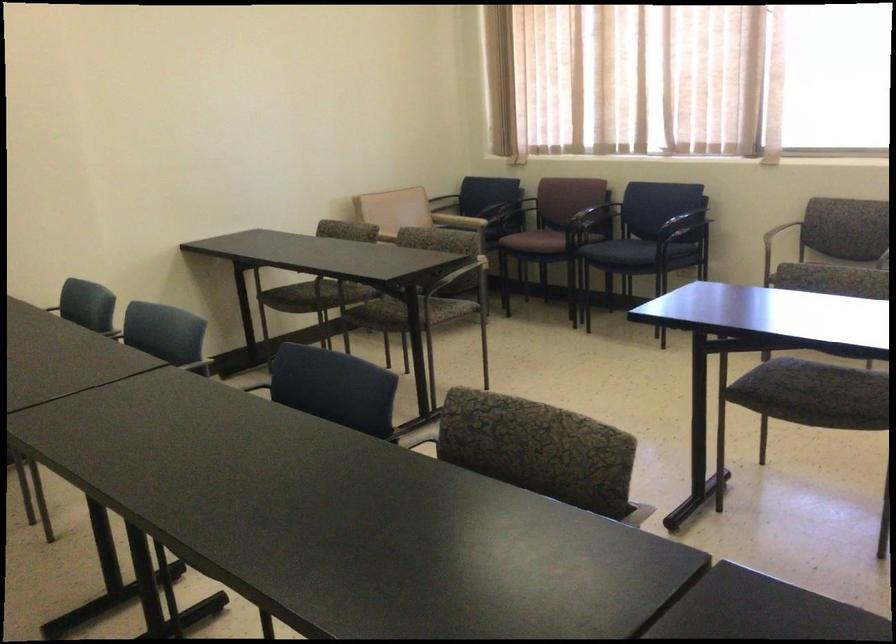
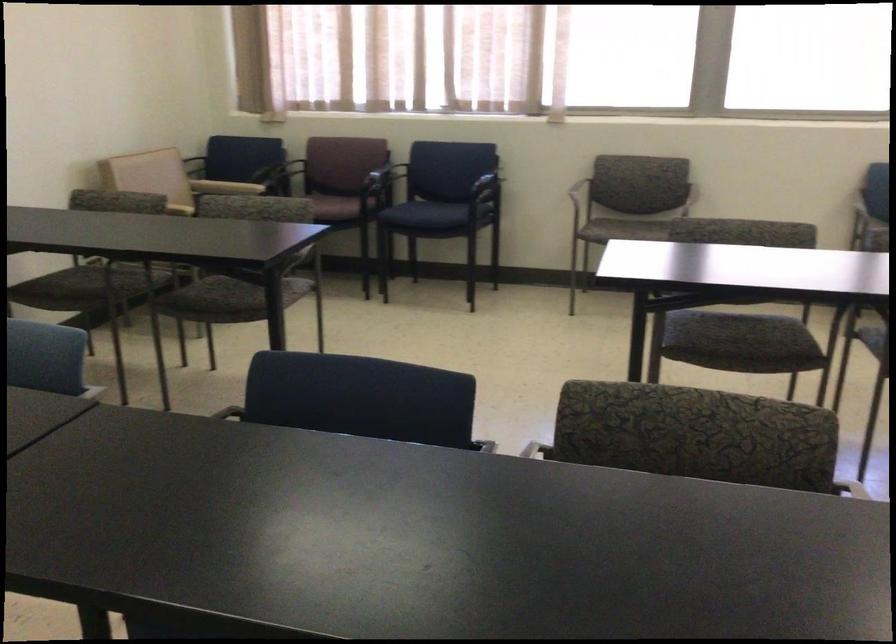
In a continuous first-person perspective shot, in which direction is the camera moving?

The cameraman walked toward left, forward.